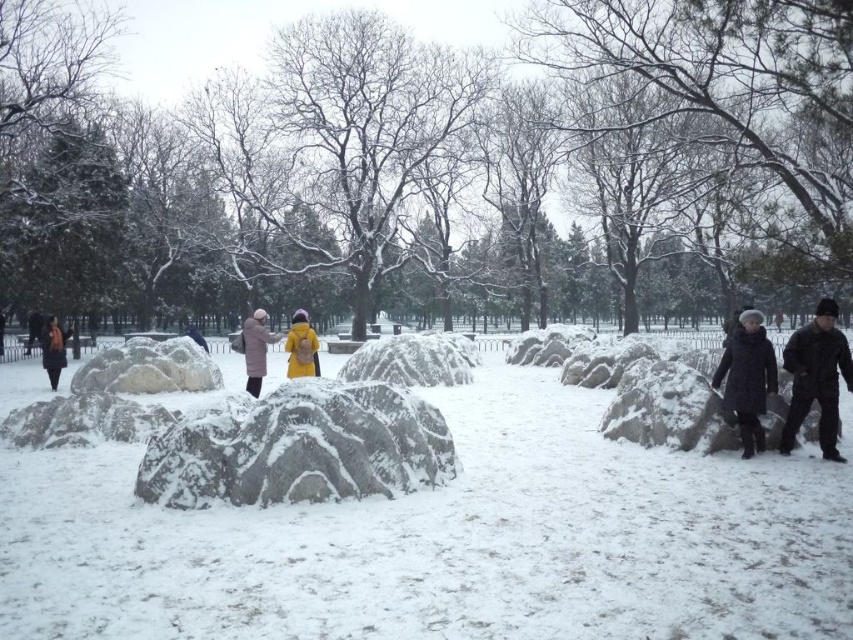
Question: Is white textured snow at center wider than matte black jacket at left?

Choices:
 (A) yes
 (B) no

Answer: (A)

Question: Among these points, which one is nearest to the camera?

Choices:
 (A) (49, 321)
 (B) (33, 332)
 (C) (138, 497)
 (D) (199, 337)

Answer: (C)

Question: Can you confirm if black matte jacket at right is positioned to the right of yellow matte jacket at center?

Choices:
 (A) yes
 (B) no

Answer: (A)

Question: Considering the real-world distances, which object is closest to the matte black jacket at left?

Choices:
 (A) white textured snow at center
 (B) snow-covered granite boulder at center
 (C) black matte jacket at right
 (D) yellow woolen coat at center

Answer: (D)

Question: Does snow-covered granite boulder at center have a larger size compared to yellow woolen coat at center?

Choices:
 (A) yes
 (B) no

Answer: (B)

Question: Which is farther from the matte black jacket at left?

Choices:
 (A) yellow matte jacket at center
 (B) black wool coat at right
 (C) matte black coat at left
 (D) white textured snow at center

Answer: (B)